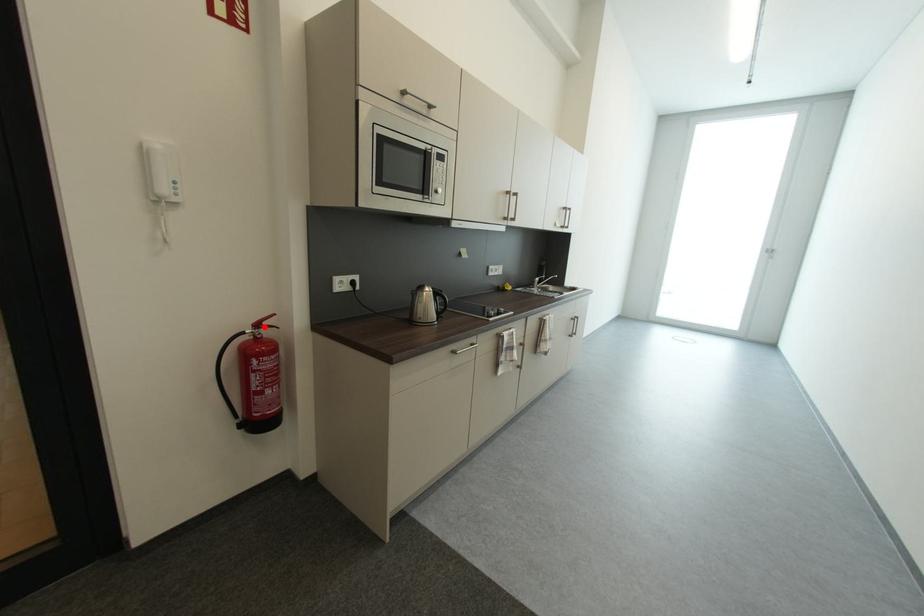
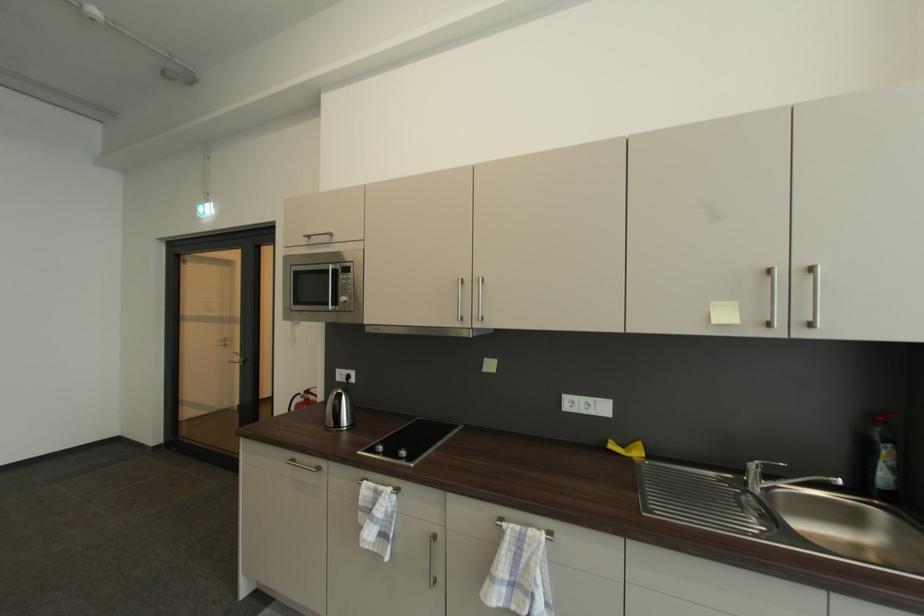
Question: I am providing you with two images of the same scene from different viewpoints. Given a red point in image1, look at the same physical point in image2. Is it:

Choices:
 (A) Closer to the viewpoint
 (B) Farther from the viewpoint

Answer: (B)